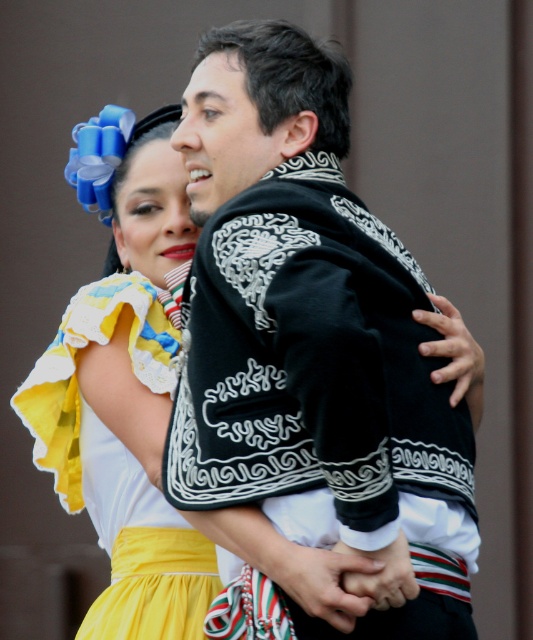
Question: Is black embroidered jacket at center smaller than yellow satin dress at lower left?

Choices:
 (A) yes
 (B) no

Answer: (B)

Question: Which object appears closest to the camera in this image?

Choices:
 (A) black embroidered jacket at center
 (B) yellow satin dress at lower left

Answer: (A)

Question: Which of the following is the closest to the observer?

Choices:
 (A) black embroidered jacket at center
 (B) yellow satin dress at lower left

Answer: (A)

Question: Is black embroidered jacket at center above yellow satin dress at lower left?

Choices:
 (A) no
 (B) yes

Answer: (B)

Question: Which object appears farthest from the camera in this image?

Choices:
 (A) yellow satin dress at lower left
 (B) black embroidered jacket at center

Answer: (A)

Question: Is black embroidered jacket at center to the left of yellow satin dress at lower left from the viewer's perspective?

Choices:
 (A) yes
 (B) no

Answer: (B)